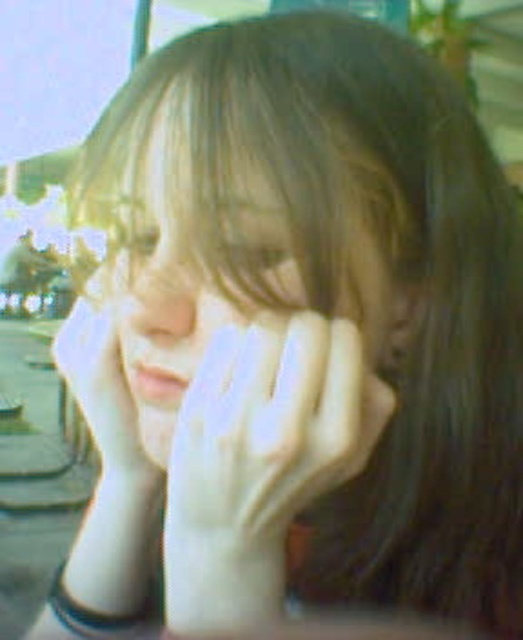
You are a photographer trying to capture a clear portrait of the subject. The subject has their hands near their face, which is partially obscured. You need to ensure that both the smooth skin face at center and the smooth skin nose at center are visible. Given that the distance between them is 0.94 inches, will adjusting the focus to 1 inch allow both features to be in focus?

The smooth skin face at center is 0.94 inches from the smooth skin nose at center. Since the focus adjustment of 1 inch covers this distance, both features will be in focus.

You are a photographer trying to frame a portrait. You notice the white matte glove at center and the smooth skin face at center in your viewfinder. Which object should you adjust your focus to ensure the smaller one is sharp?

The white matte glove at center is smaller than the smooth skin face at center, so you should adjust your focus on the white matte glove at center to ensure the smaller one is sharp.

Looking at the image, which object is positioned to the left of the other between the smooth skin face at center and the smooth skin nose at center?

The smooth skin nose at center is positioned to the left of the smooth skin face at center.